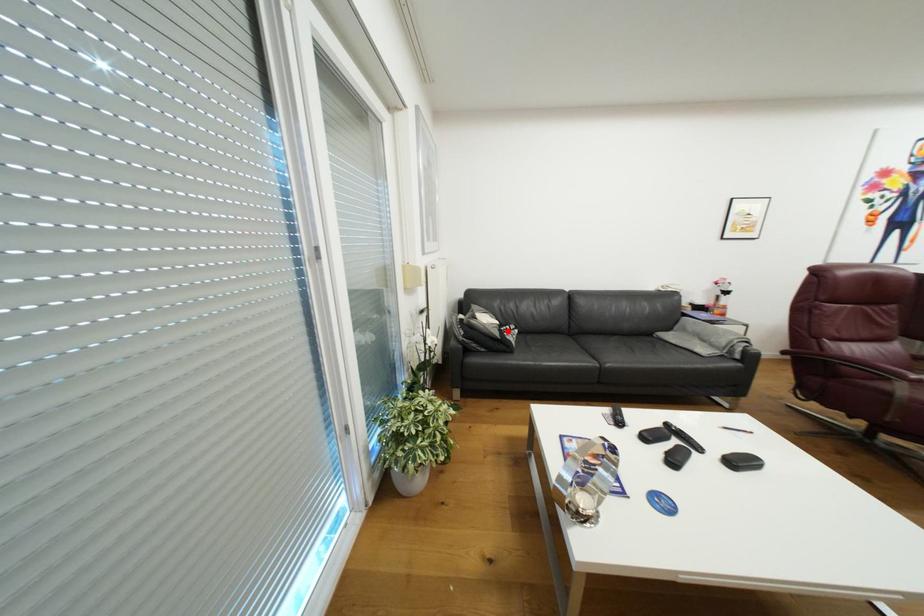
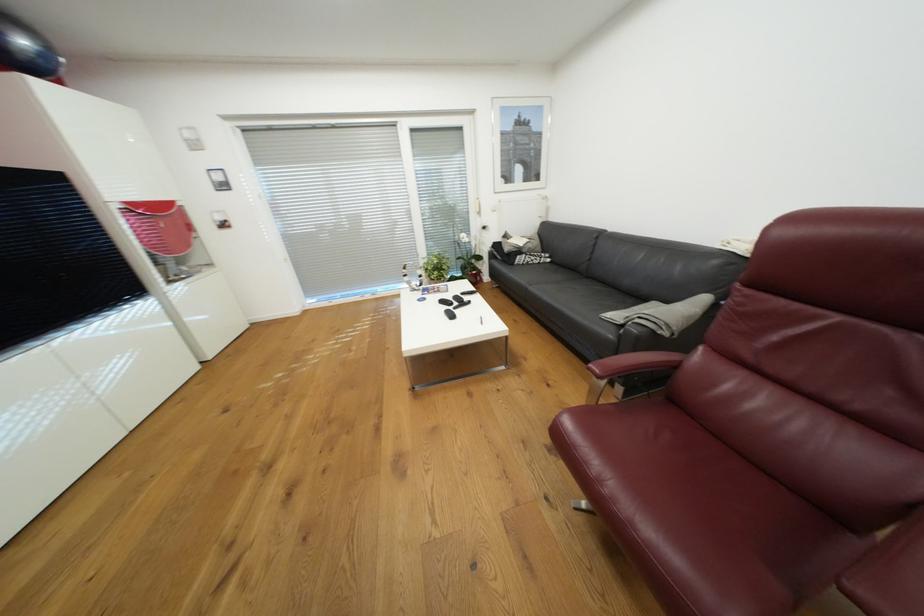
Question: I am providing you with two images of the same scene from different viewpoints. A red point is shown in image1. For the corresponding object point in image2, is it positioned nearer or farther from the camera?

Choices:
 (A) Nearer
 (B) Farther

Answer: (A)